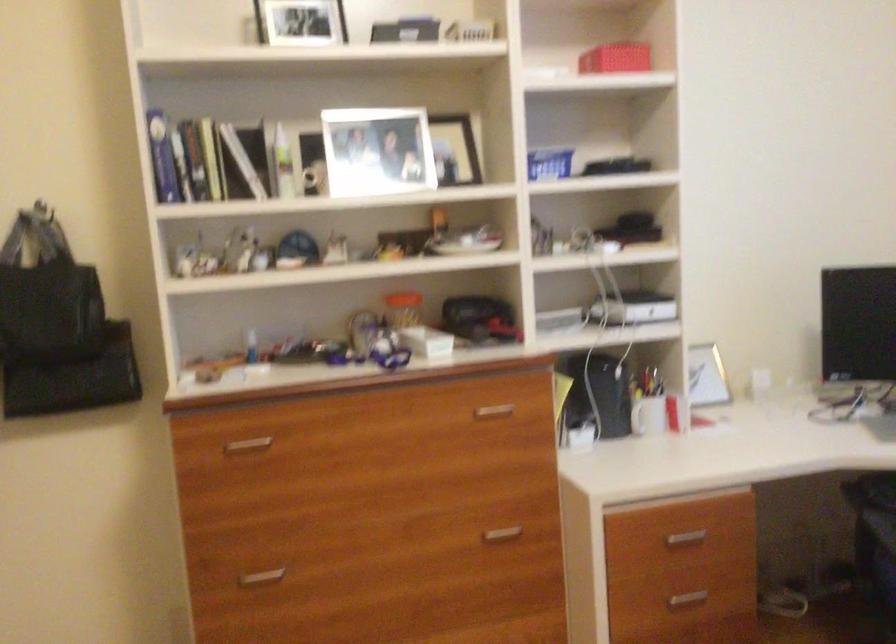
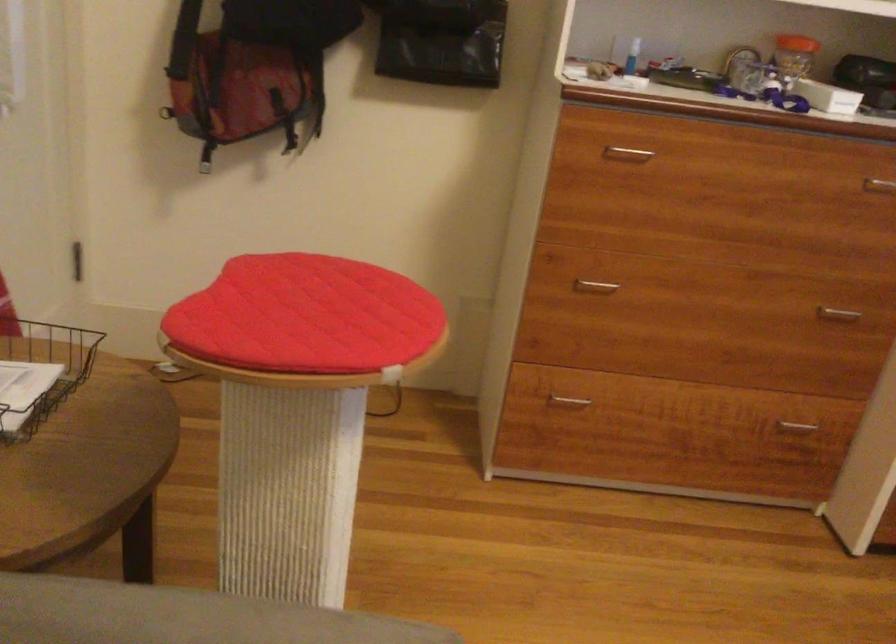
Find the pixel in the second image that matches point 255,446 in the first image.

(626, 154)